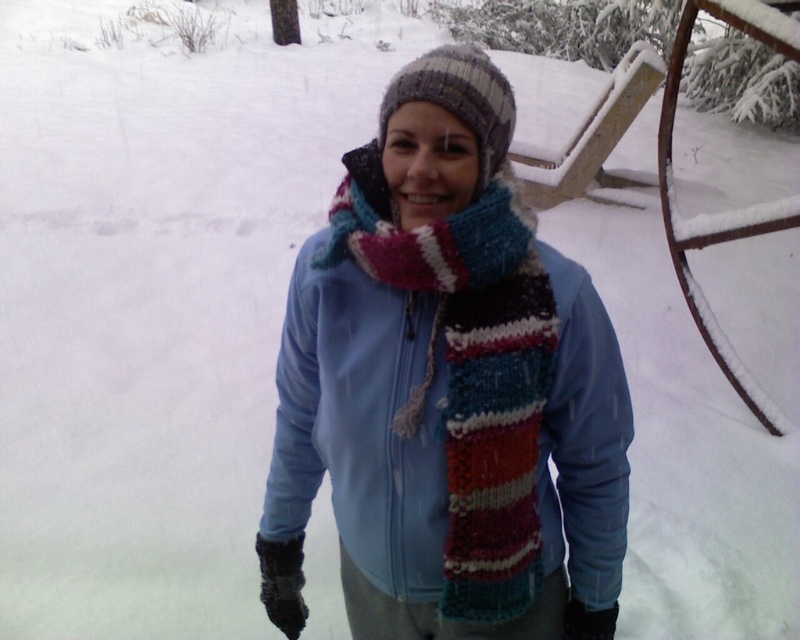
Question: Does knitted wool scarf at center lie behind knitted woolen hat at center?

Choices:
 (A) no
 (B) yes

Answer: (B)

Question: Among these points, which one is nearest to the camera?

Choices:
 (A) (490, 147)
 (B) (440, 292)

Answer: (A)

Question: Which point is closer to the camera?

Choices:
 (A) (492, 93)
 (B) (516, 547)

Answer: (A)

Question: Is knitted wool scarf at center positioned before knitted woolen hat at center?

Choices:
 (A) yes
 (B) no

Answer: (B)

Question: Does knitted wool scarf at center appear over knitted woolen hat at center?

Choices:
 (A) no
 (B) yes

Answer: (A)